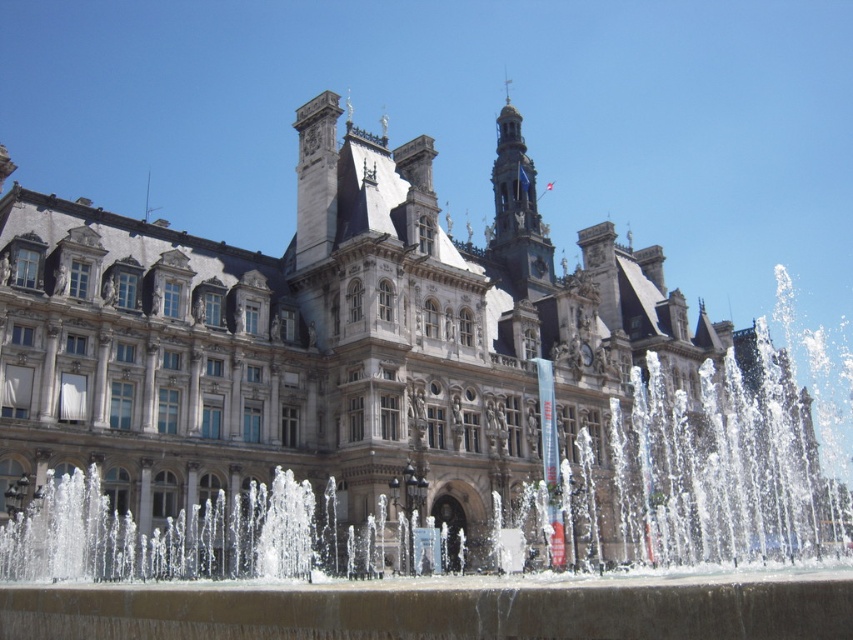
You are a photographer planning to capture the grand building and its surroundings. You notice the clear water at center and the gray stone tower at upper center in your viewfinder. Which object occupies a larger area in the image?

The clear water at center is bigger than the gray stone tower at upper center, so it occupies a larger area in the image.

You are standing at the entrance of the grand building and want to find the clear water at center. According to the coordinates given, where should you look relative to the building?

The clear water at center is located at coordinates point (x=434, y=612), which means it is positioned to the right and slightly above the center of the building.